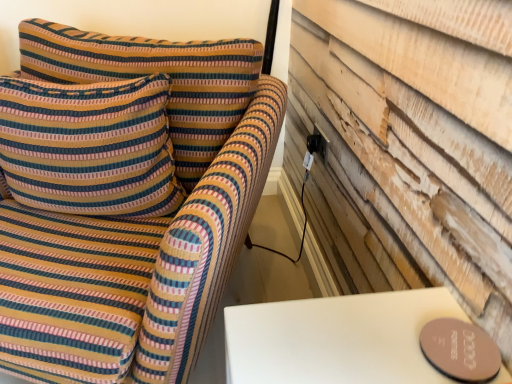
Describe the element at coordinates (125, 198) in the screenshot. This screenshot has height=384, width=512. I see `striped fabric sofa at left` at that location.

Image resolution: width=512 pixels, height=384 pixels. Identify the location of striped fabric sofa at left. (125, 198).

Locate an element on the screen. The image size is (512, 384). striped fabric pillow at left is located at coordinates (89, 147).

The height and width of the screenshot is (384, 512). What do you see at coordinates (89, 147) in the screenshot? I see `striped fabric pillow at left` at bounding box center [89, 147].

Measure the distance between point (57, 154) and camera.

The distance of point (57, 154) from camera is 37.72 inches.

Identify the location of striped fabric sofa at left. (125, 198).

Is striped fabric pillow at left to the left or to the right of striped fabric sofa at left in the image?

Clearly, striped fabric pillow at left is on the left of striped fabric sofa at left in the image.

Considering the relative positions of striped fabric pillow at left and striped fabric sofa at left in the image provided, is striped fabric pillow at left behind striped fabric sofa at left?

Yes, striped fabric pillow at left is further from the camera.

Which point is more distant from viewer, (x=9, y=179) or (x=203, y=171)?

The point (x=203, y=171) is more distant.

From the image's perspective, is striped fabric pillow at left positioned above or below striped fabric sofa at left?

Clearly, from the image's perspective, striped fabric pillow at left is above striped fabric sofa at left.

From a real-world perspective, between striped fabric pillow at left and striped fabric sofa at left, who is vertically higher?

In real-world perspective, striped fabric pillow at left is above.

In terms of width, does striped fabric pillow at left look wider or thinner when compared to striped fabric sofa at left?

In the image, striped fabric pillow at left appears to be more narrow than striped fabric sofa at left.

Considering the sizes of striped fabric pillow at left and striped fabric sofa at left in the image, is striped fabric pillow at left taller or shorter than striped fabric sofa at left?

striped fabric pillow at left is shorter than striped fabric sofa at left.

Who is bigger, striped fabric pillow at left or striped fabric sofa at left?

Bigger between the two is striped fabric sofa at left.

Is striped fabric sofa at left completely or partially inside striped fabric pillow at left?

No, striped fabric sofa at left is not surrounded by striped fabric pillow at left.

From the picture: Are striped fabric pillow at left and striped fabric sofa at left making contact?

No, striped fabric pillow at left is not in contact with striped fabric sofa at left.

Is striped fabric pillow at left aimed at striped fabric sofa at left?

Yes, striped fabric pillow at left is turned towards striped fabric sofa at left.

Looking at this image, how different are the orientations of striped fabric pillow at left and striped fabric sofa at left in degrees?

There is a 13.8-degree angle between the facing directions of striped fabric pillow at left and striped fabric sofa at left.

This screenshot has width=512, height=384. In order to click on furniture located below the striped fabric pillow at left (from the image's perspective) in this screenshot , I will do `click(125, 198)`.

Considering the relative positions of striped fabric sofa at left and striped fabric pillow at left in the image provided, is striped fabric sofa at left to the right of striped fabric pillow at left from the viewer's perspective?

Correct, you'll find striped fabric sofa at left to the right of striped fabric pillow at left.

In the image, is striped fabric sofa at left positioned in front of or behind striped fabric pillow at left?

In the image, striped fabric sofa at left appears in front of striped fabric pillow at left.

Considering the points (65, 216) and (66, 129), which point is in front, point (65, 216) or point (66, 129)?

The point (66, 129) is more forward.

From the image's perspective, relative to striped fabric pillow at left, is striped fabric sofa at left above or below?

From the image's perspective, striped fabric sofa at left appears below striped fabric pillow at left.

From the picture: From a real-world perspective, who is located lower, striped fabric sofa at left or striped fabric pillow at left?

In real-world perspective, striped fabric sofa at left is lower.

Which object is thinner, striped fabric sofa at left or striped fabric pillow at left?

Thinner between the two is striped fabric pillow at left.

Which of these two, striped fabric sofa at left or striped fabric pillow at left, stands shorter?

With less height is striped fabric pillow at left.

Based on the photo, which of these two, striped fabric sofa at left or striped fabric pillow at left, is smaller?

striped fabric pillow at left is smaller.

Which is correct: striped fabric sofa at left is inside striped fabric pillow at left, or outside of it?

striped fabric sofa at left is spatially situated outside striped fabric pillow at left.

Can you see striped fabric sofa at left touching striped fabric pillow at left?

No, striped fabric sofa at left is not touching striped fabric pillow at left.

Is striped fabric sofa at left looking in the opposite direction of striped fabric pillow at left?

Yes, striped fabric sofa at left's orientation is away from striped fabric pillow at left.

Locate an element on the screen. Image resolution: width=512 pixels, height=384 pixels. furniture on the right of striped fabric pillow at left is located at coordinates (125, 198).

This screenshot has width=512, height=384. Find the location of `pillow that appears above the striped fabric sofa at left (from a real-world perspective)`. pillow that appears above the striped fabric sofa at left (from a real-world perspective) is located at coordinates (89, 147).

The image size is (512, 384). Identify the location of pillow behind the striped fabric sofa at left. (89, 147).